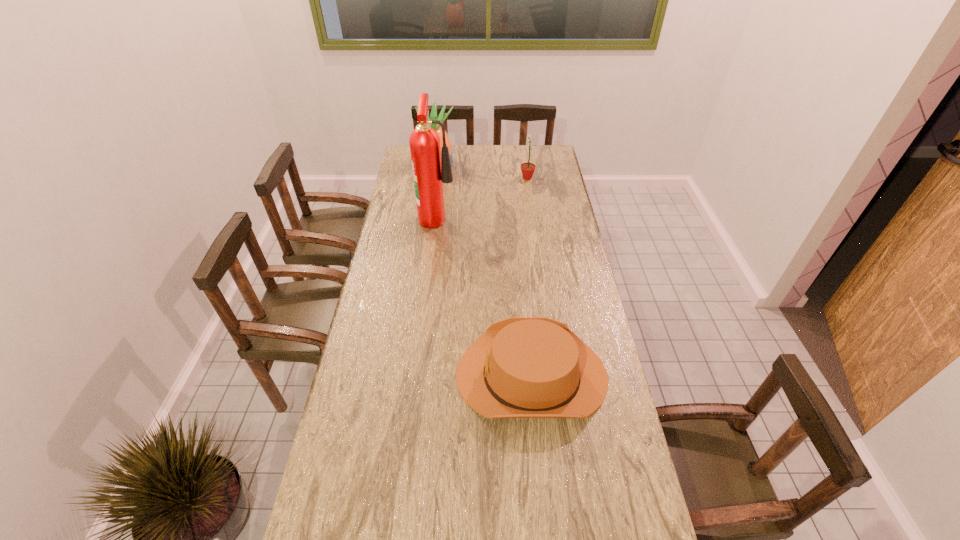
The width and height of the screenshot is (960, 540). I want to click on fire extinguisher, so pyautogui.click(x=429, y=171).

Locate an element on the screen. This screenshot has height=540, width=960. the tallest object is located at coordinates (429, 171).

Identify the location of pineapple. Image resolution: width=960 pixels, height=540 pixels. (433, 116).

Find the location of `sunflower`. sunflower is located at coordinates (527, 169).

The image size is (960, 540). In order to click on cowboy hat in this screenshot , I will do `click(521, 367)`.

Where is `the nearest object`? the nearest object is located at coordinates (521, 367).

This screenshot has height=540, width=960. I want to click on vacant space located 0.270m at the nozzle of the fire extinguisher, so click(517, 216).

Identify the location of free spot located at the entrance of the pineapple. The height and width of the screenshot is (540, 960). (475, 165).

The image size is (960, 540). Find the location of `vacant space positioned on the face of the second shortest object`. vacant space positioned on the face of the second shortest object is located at coordinates (460, 178).

This screenshot has height=540, width=960. What are the coordinates of `vacant area situated on the face of the second shortest object` in the screenshot? It's located at (479, 178).